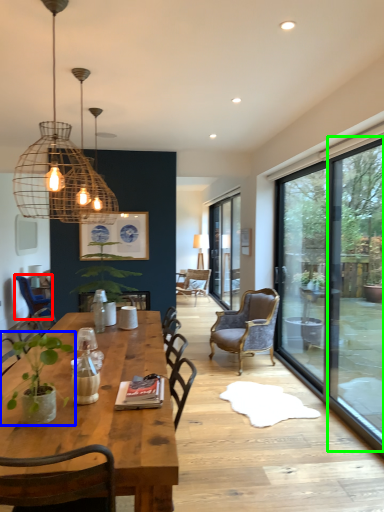
Question: Which is farther away from chair (highlighted by a red box)? houseplant (highlighted by a blue box) or window screen (highlighted by a green box)?

Choices:
 (A) houseplant
 (B) window screen

Answer: (B)